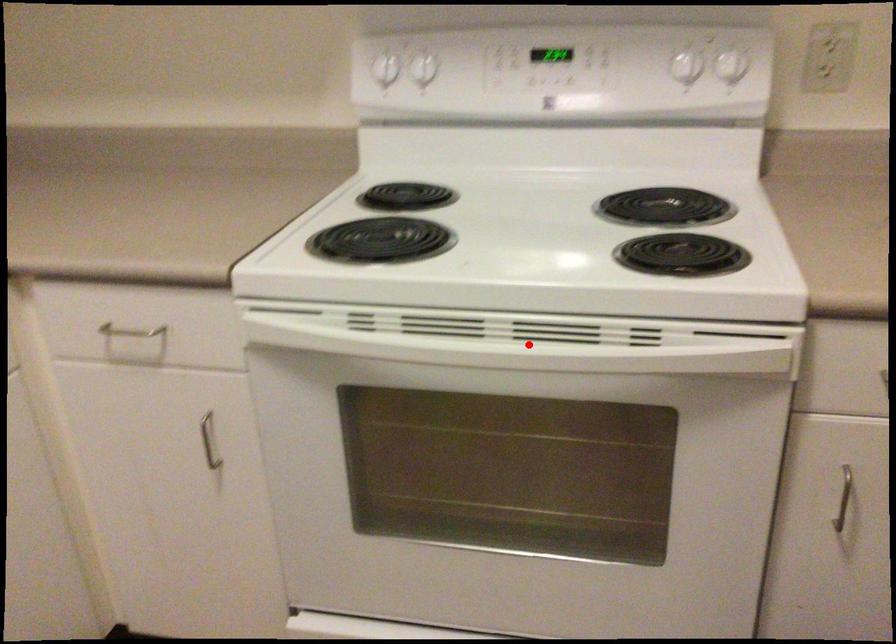
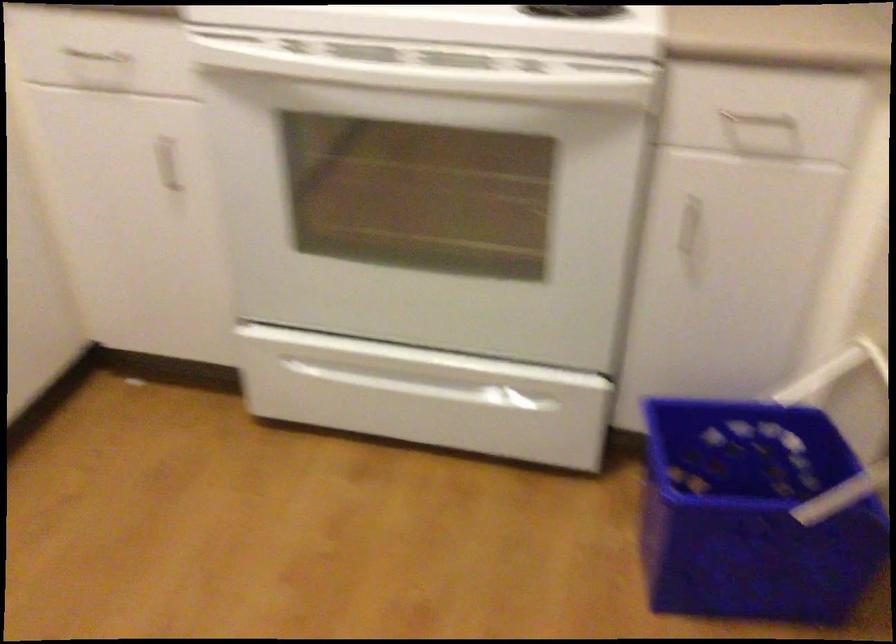
Find the pixel in the second image that matches the highlighted location in the first image.

(437, 77)